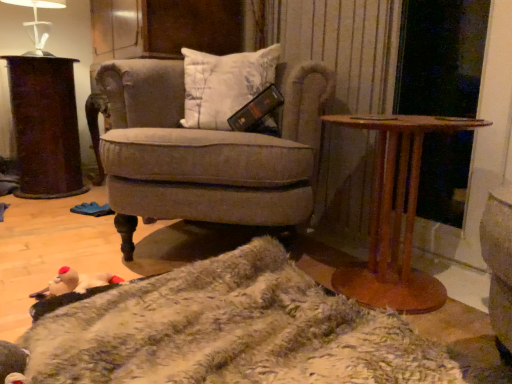
Question: Is dark brown polished wood desk at left thinner than white glossy table lamp at upper left?

Choices:
 (A) no
 (B) yes

Answer: (A)

Question: Considering the relative sizes of dark brown polished wood desk at left and white glossy table lamp at upper left in the image provided, is dark brown polished wood desk at left smaller than white glossy table lamp at upper left?

Choices:
 (A) yes
 (B) no

Answer: (B)

Question: Can you confirm if dark brown polished wood desk at left is positioned to the left of white glossy table lamp at upper left?

Choices:
 (A) no
 (B) yes

Answer: (B)

Question: From the image's perspective, is dark brown polished wood desk at left below white glossy table lamp at upper left?

Choices:
 (A) yes
 (B) no

Answer: (A)

Question: Would you consider dark brown polished wood desk at left to be distant from white glossy table lamp at upper left?

Choices:
 (A) no
 (B) yes

Answer: (A)

Question: Is white glossy table lamp at upper left spatially inside fuzzy beige blanket at lower center, or outside of it?

Choices:
 (A) inside
 (B) outside

Answer: (B)

Question: Looking at their shapes, would you say white glossy table lamp at upper left is wider or thinner than fuzzy beige blanket at lower center?

Choices:
 (A) wide
 (B) thin

Answer: (B)

Question: Is white glossy table lamp at upper left in front of or behind fuzzy beige blanket at lower center in the image?

Choices:
 (A) front
 (B) behind

Answer: (B)

Question: From the image's perspective, is white glossy table lamp at upper left positioned above or below fuzzy beige blanket at lower center?

Choices:
 (A) above
 (B) below

Answer: (A)

Question: Is fuzzy beige blanket at lower center inside or outside of velvet beige armchair at center?

Choices:
 (A) inside
 (B) outside

Answer: (B)

Question: In the image, is fuzzy beige blanket at lower center positioned in front of or behind velvet beige armchair at center?

Choices:
 (A) behind
 (B) front

Answer: (B)

Question: Considering the relative positions of fuzzy beige blanket at lower center and velvet beige armchair at center in the image provided, is fuzzy beige blanket at lower center to the left or to the right of velvet beige armchair at center?

Choices:
 (A) left
 (B) right

Answer: (B)

Question: Is fuzzy beige blanket at lower center wider or thinner than velvet beige armchair at center?

Choices:
 (A) thin
 (B) wide

Answer: (B)

Question: Based on their sizes in the image, would you say fuzzy beige blanket at lower center is bigger or smaller than dark brown polished wood desk at left?

Choices:
 (A) small
 (B) big

Answer: (A)

Question: From a real-world perspective, is fuzzy beige blanket at lower center positioned above or below dark brown polished wood desk at left?

Choices:
 (A) below
 (B) above

Answer: (A)